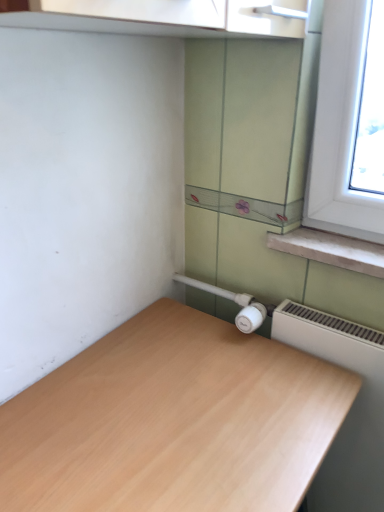
Image resolution: width=384 pixels, height=512 pixels. What do you see at coordinates (173, 421) in the screenshot?
I see `light wood table at lower right` at bounding box center [173, 421].

Where is `light wood table at lower right`? light wood table at lower right is located at coordinates (173, 421).

What are the coordinates of `light wood table at lower right` in the screenshot? It's located at point(173,421).